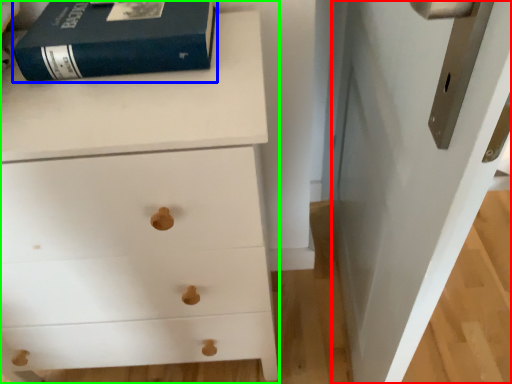
Question: Which is nearer to the door (highlighted by a red box)? paperback book (highlighted by a blue box) or chest of drawers (highlighted by a green box).

Choices:
 (A) paperback book
 (B) chest of drawers

Answer: (B)